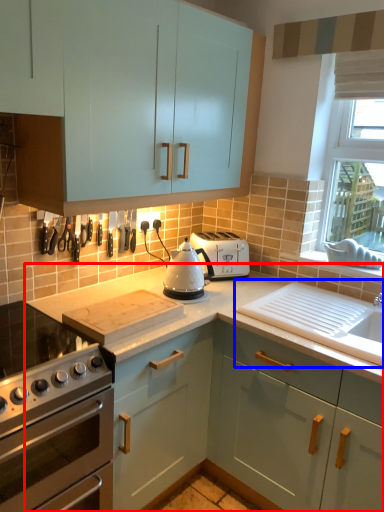
Question: Which object appears farthest to the camera in this image, countertop (highlighted by a red box) or sink (highlighted by a blue box)?

Choices:
 (A) countertop
 (B) sink

Answer: (B)